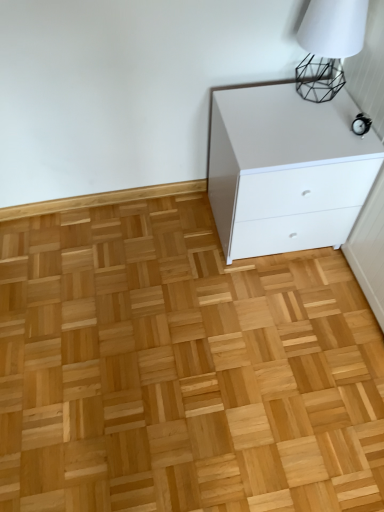
Locate an element on the screen. free space in front of white matte table lamp at upper right is located at coordinates (323, 126).